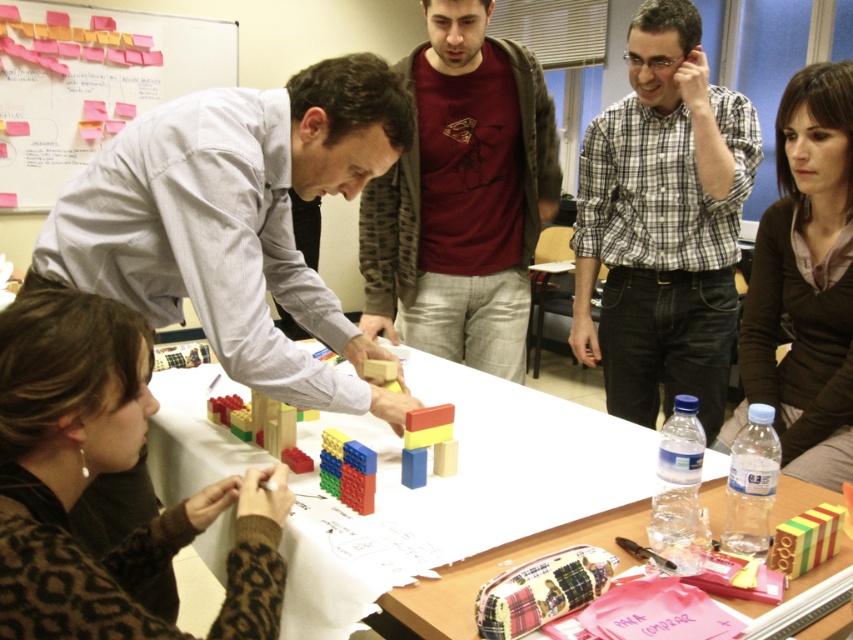
Question: Among these points, which one is farthest from the camera?

Choices:
 (A) (654, 307)
 (B) (373, 259)
 (C) (833, 406)
 (D) (833, 536)

Answer: (B)

Question: Does leopard print sweater at lower left lie behind rubberized plastic building blocks at center?

Choices:
 (A) yes
 (B) no

Answer: (B)

Question: Considering the real-world distances, which object is closest to the rubberized plastic building blocks at center?

Choices:
 (A) matte gray shirt at center
 (B) rubberized plastic blocks at center
 (C) brown zippered jacket at upper right

Answer: (B)

Question: Observing the image, what is the correct spatial positioning of maroon t-shirt at center in reference to rubberized plastic building blocks at center?

Choices:
 (A) below
 (B) above

Answer: (B)

Question: Estimate the real-world distances between objects in this image. Which object is farther from the matte gray shirt at center?

Choices:
 (A) brown zippered jacket at upper right
 (B) rubberized plastic blocks at center
 (C) white plastic table at center

Answer: (A)

Question: Does matte gray shirt at center have a larger size compared to rubberized plastic building blocks at center?

Choices:
 (A) no
 (B) yes

Answer: (B)